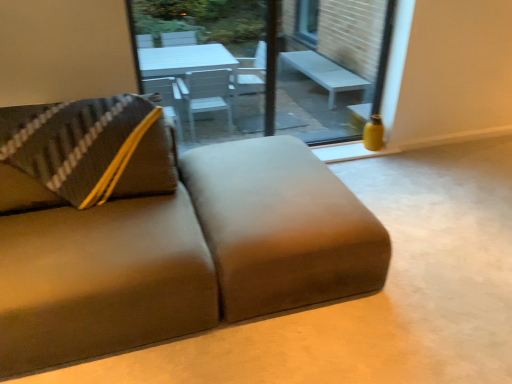
The height and width of the screenshot is (384, 512). I want to click on empty space that is to the right of suede-like beige footrest at lower center, so click(431, 245).